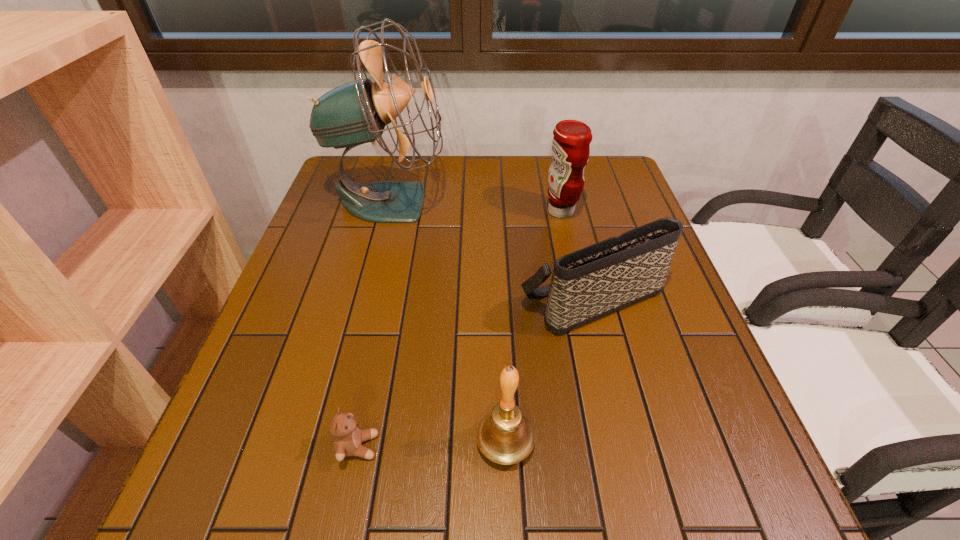
The image size is (960, 540). What are the coordinates of `fan` in the screenshot? It's located at (355, 113).

Where is `condiment`? This screenshot has height=540, width=960. condiment is located at coordinates (571, 143).

Where is `bell`? bell is located at coordinates (505, 436).

Find the location of `handbag`. handbag is located at coordinates (592, 282).

I want to click on the third nearest object, so click(x=592, y=282).

Find the location of a particular element. The width and height of the screenshot is (960, 540). the shortest object is located at coordinates (348, 438).

Where is `vacant space located on the front-facing side of the tallest object for air flow`? This screenshot has height=540, width=960. vacant space located on the front-facing side of the tallest object for air flow is located at coordinates (538, 202).

The image size is (960, 540). I want to click on vacant space located 0.200m on the left of the condiment, so click(472, 212).

Identify the location of vacant position located 0.330m on the right of the bell. This screenshot has height=540, width=960. (729, 443).

The image size is (960, 540). What are the coordinates of `vacant area situated 0.380m on the left of the third nearest object` in the screenshot? It's located at (348, 299).